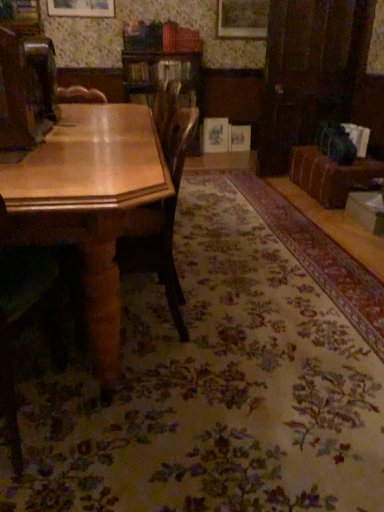
Question: In the image, is wooden chair at center, marked as the 1th chair in a right-to-left arrangement, positioned in front of or behind velvet brown couch at right?

Choices:
 (A) behind
 (B) front

Answer: (B)

Question: In terms of width, does wooden chair at center, which is the second chair from left to right, look wider or thinner when compared to velvet brown couch at right?

Choices:
 (A) wide
 (B) thin

Answer: (B)

Question: Estimate the real-world distances between objects in this image. Which object is closer to the velvet brown couch at right?

Choices:
 (A) wooden chair at left, the 2th chair in the right-to-left sequence
 (B) wooden table at left
 (C) wooden chair at center, marked as the 1th chair in a right-to-left arrangement

Answer: (C)

Question: Which object is the farthest from the velvet brown couch at right?

Choices:
 (A) wooden chair at left, acting as the 1th chair starting from the left
 (B) wooden table at left
 (C) wooden chair at center, which is the second chair from left to right

Answer: (A)